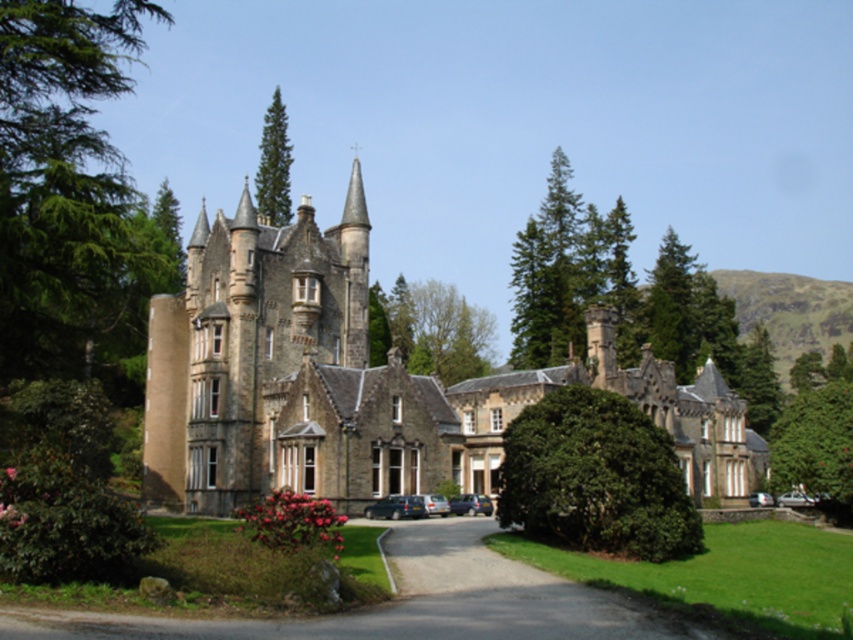
Can you confirm if metallic silver car at lower right is taller than silver metallic car at lower right?

Indeed, metallic silver car at lower right has a greater height compared to silver metallic car at lower right.

Does metallic silver car at lower right have a lesser width compared to silver metallic car at lower right?

No.

Is point (796, 504) in front of point (763, 497)?

Yes, point (796, 504) is in front of point (763, 497).

Where is `metallic silver car at lower right`? metallic silver car at lower right is located at coordinates (793, 499).

Is green leafy tree at center bigger than metallic gray car at center?

Correct, green leafy tree at center is larger in size than metallic gray car at center.

Is green leafy tree at center smaller than metallic gray car at center?

No, green leafy tree at center is not smaller than metallic gray car at center.

What do you see at coordinates (430, 330) in the screenshot?
I see `green leafy tree at center` at bounding box center [430, 330].

What are the coordinates of `green leafy tree at center` in the screenshot? It's located at (430, 330).

Who is taller, metallic silver car at center or silver metallic car at lower right?

With more height is silver metallic car at lower right.

What do you see at coordinates (469, 504) in the screenshot? The width and height of the screenshot is (853, 640). I see `metallic silver car at center` at bounding box center [469, 504].

The width and height of the screenshot is (853, 640). Identify the location of metallic silver car at center. (469, 504).